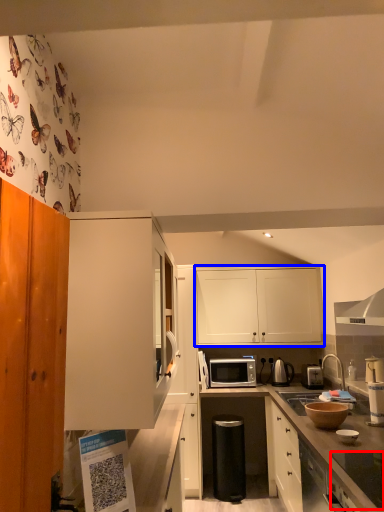
Question: Which object appears farthest to the camera in this image, appliance (highlighted by a red box) or cabinetry (highlighted by a blue box)?

Choices:
 (A) appliance
 (B) cabinetry

Answer: (B)